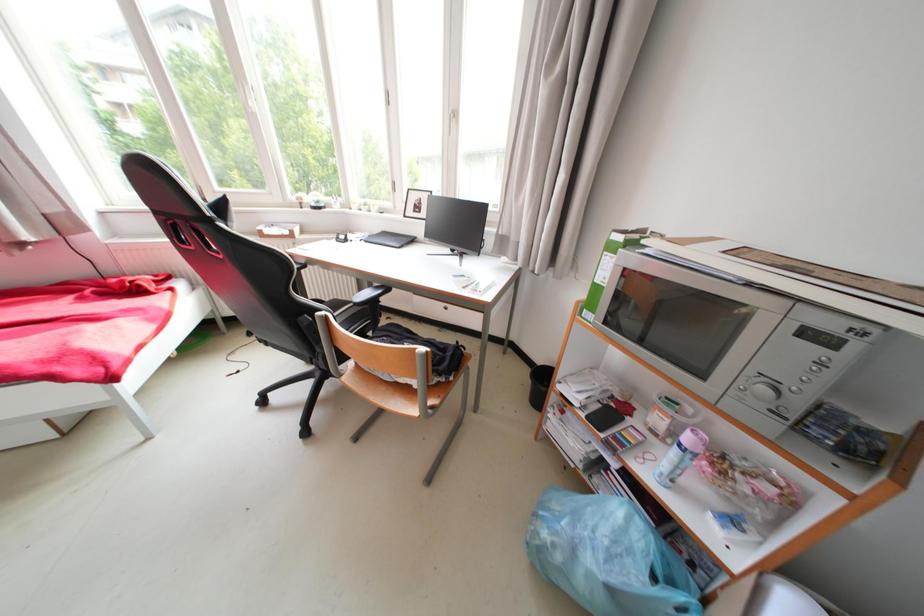
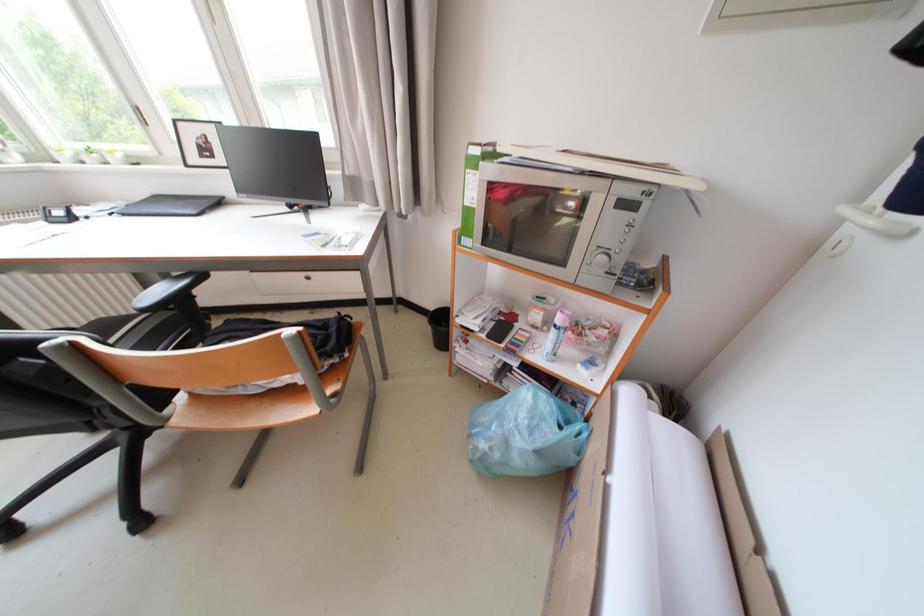
Question: Based on the continuous images, in which direction is the camera rotating? Reply with the corresponding letter.

Choices:
 (A) Left
 (B) Right
 (C) Up
 (D) Down

Answer: (B)